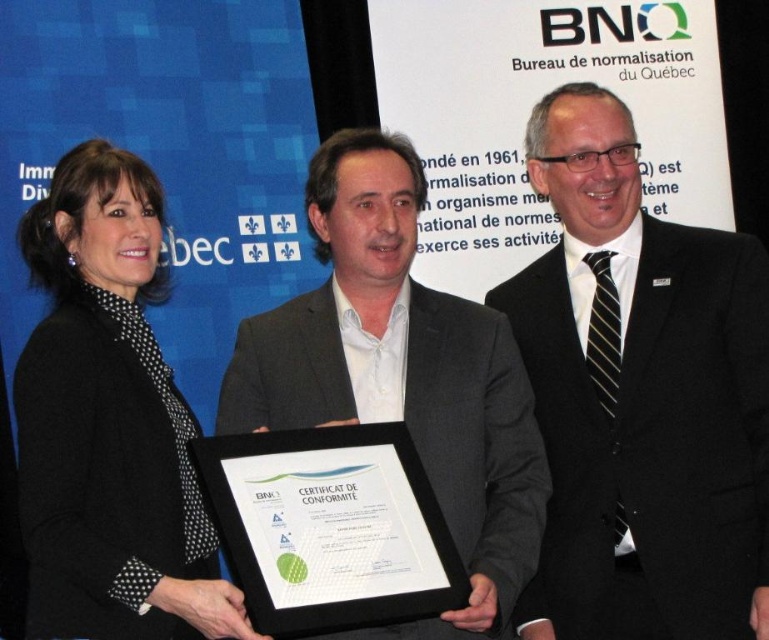
Question: Is black dotted blazer at left positioned at the back of matte gray suit at center?

Choices:
 (A) no
 (B) yes

Answer: (A)

Question: Can you confirm if black suit at center is smaller than black dotted blazer at left?

Choices:
 (A) yes
 (B) no

Answer: (A)

Question: Can you confirm if black suit at center is positioned above black dotted blazer at left?

Choices:
 (A) no
 (B) yes

Answer: (B)

Question: Which object is farther from the camera taking this photo?

Choices:
 (A) black dotted blazer at left
 (B) matte gray suit at center

Answer: (B)

Question: Which of the following is the closest to the observer?

Choices:
 (A) (661, 369)
 (B) (485, 440)

Answer: (A)

Question: Which object is the farthest from the black suit at center?

Choices:
 (A) matte gray suit at center
 (B) black dotted blazer at left

Answer: (B)